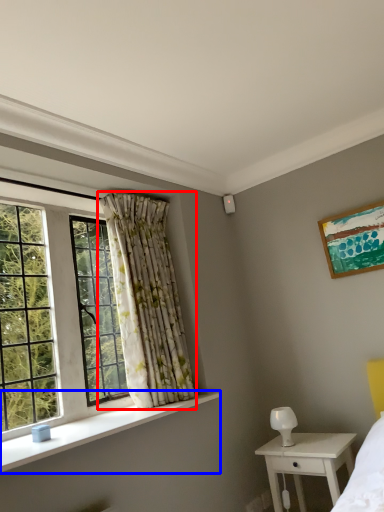
Question: Which object appears farthest to the camera in this image, curtain (highlighted by a red box) or window sill (highlighted by a blue box)?

Choices:
 (A) curtain
 (B) window sill

Answer: (A)